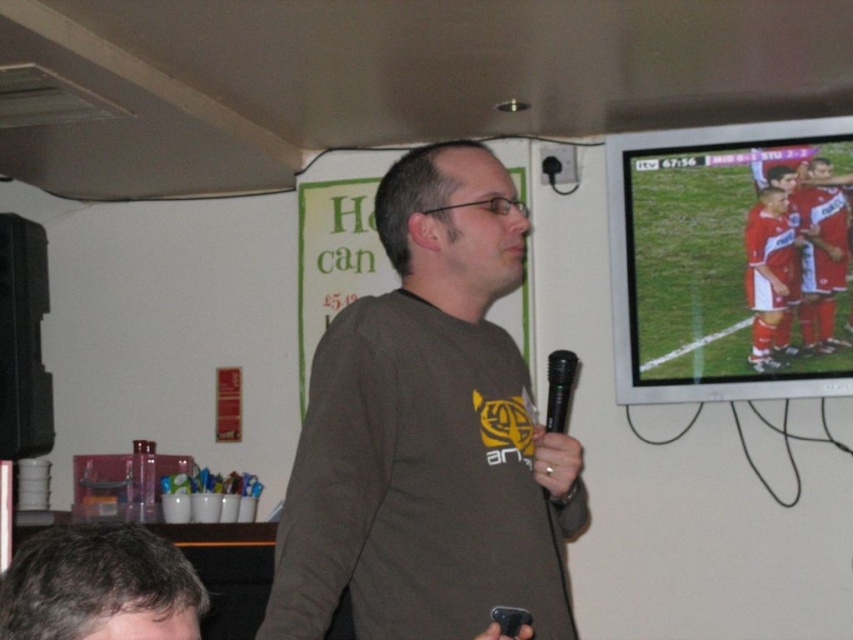
Question: Which object is farther from the camera taking this photo?

Choices:
 (A) red fabric soccer players at upper right
 (B) black metallic microphone at center

Answer: (A)

Question: Which of the following is the farthest from the observer?

Choices:
 (A) (549, 416)
 (B) (677, 173)
 (C) (39, 570)

Answer: (B)

Question: Can you confirm if matte brown shirt at center is thinner than black metallic microphone at center?

Choices:
 (A) yes
 (B) no

Answer: (B)

Question: Which point is farther to the camera?

Choices:
 (A) (33, 586)
 (B) (799, 312)
 (C) (563, 353)

Answer: (B)

Question: Does dark brown hair at lower left appear on the left side of black metallic microphone at center?

Choices:
 (A) yes
 (B) no

Answer: (A)

Question: Does red fabric soccer players at upper right appear on the right side of black metallic microphone at center?

Choices:
 (A) no
 (B) yes

Answer: (B)